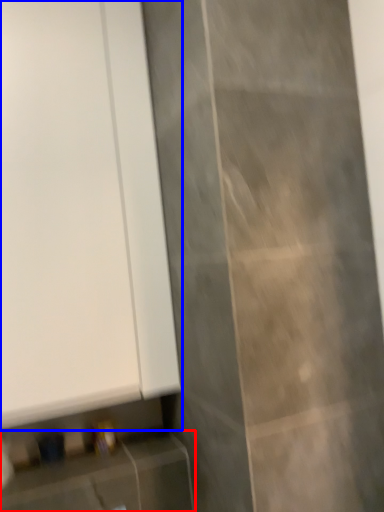
Question: Which point is closer to the camera, cabinetry (highlighted by a red box) or door (highlighted by a blue box)?

Choices:
 (A) cabinetry
 (B) door

Answer: (A)